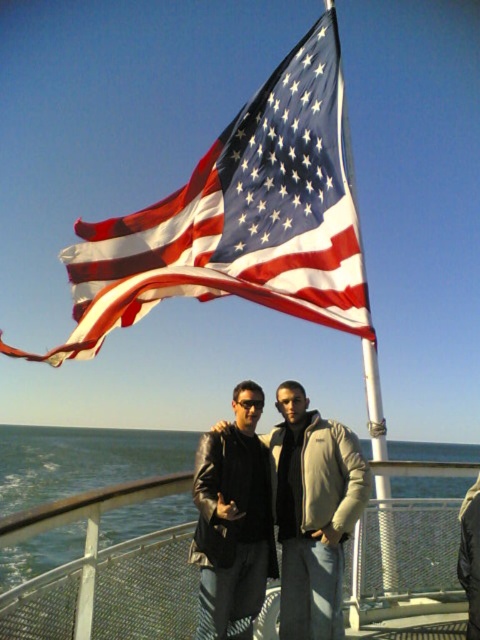
Question: Can you confirm if american flag at upper center is thinner than leather jacket at center?

Choices:
 (A) no
 (B) yes

Answer: (A)

Question: Which object is farther from the camera taking this photo?

Choices:
 (A) matte black leather jacket at center
 (B) leather jacket at center
 (C) american flag at upper center

Answer: (C)

Question: Among these points, which one is nearest to the camera?

Choices:
 (A) (324, 545)
 (B) (474, 600)

Answer: (B)

Question: Considering the relative positions of american flag at upper center and khaki cotton jacket at center in the image provided, where is american flag at upper center located with respect to khaki cotton jacket at center?

Choices:
 (A) above
 (B) below

Answer: (A)

Question: Can you confirm if blue water at lower left is positioned above leather jacket at center?

Choices:
 (A) yes
 (B) no

Answer: (B)

Question: Which is nearer to the blue water at lower left?

Choices:
 (A) american flag at upper center
 (B) matte black leather jacket at center
 (C) leather jacket at center

Answer: (B)